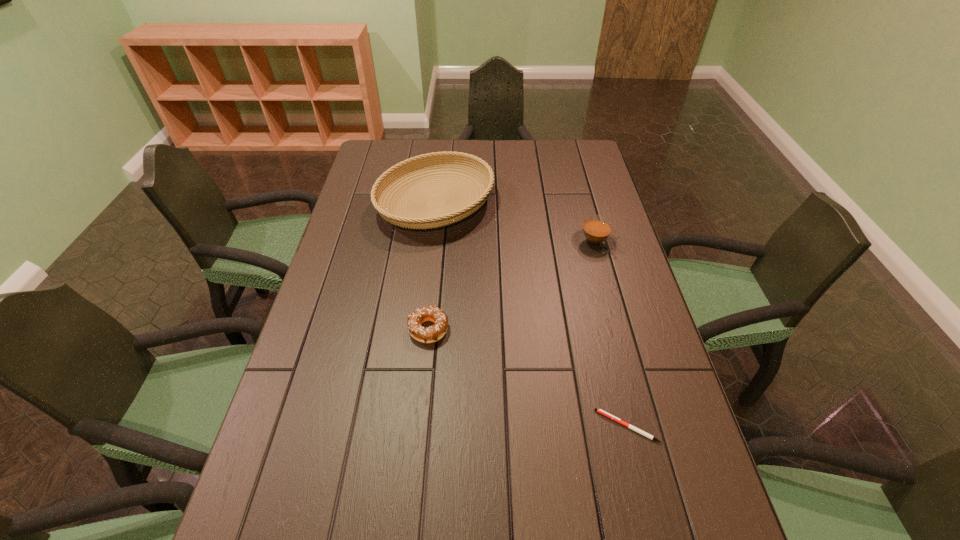
The image size is (960, 540). In order to click on vacant space positioned on the clicker of the nearest object in this screenshot , I will do `click(463, 426)`.

The height and width of the screenshot is (540, 960). In order to click on vacant space situated on the clicker of the nearest object in this screenshot , I will do `click(561, 426)`.

Find the location of `object situated at the far edge`. object situated at the far edge is located at coordinates (421, 219).

I want to click on object situated at the left edge, so click(421, 219).

Identify the location of cappuccino that is at the right edge. tap(595, 236).

Find the location of `pen situated at the right edge`. pen situated at the right edge is located at coordinates (600, 411).

Locate an element on the screen. This screenshot has width=960, height=540. object situated at the far left corner is located at coordinates (421, 219).

Locate an element on the screen. vacant space at the left edge of the desktop is located at coordinates (356, 315).

In the image, there is a desktop. Where is `vacant space at the right edge`? This screenshot has height=540, width=960. vacant space at the right edge is located at coordinates (629, 275).

You are a GUI agent. You are given a task and a screenshot of the screen. Output one action in this format:
    pyautogui.click(x=<x>, y=<y>)
    Task: Click on the blank area at the far left corner
    Image resolution: width=960 pixels, height=540 pixels.
    Given the screenshot: What is the action you would take?
    pyautogui.click(x=372, y=144)